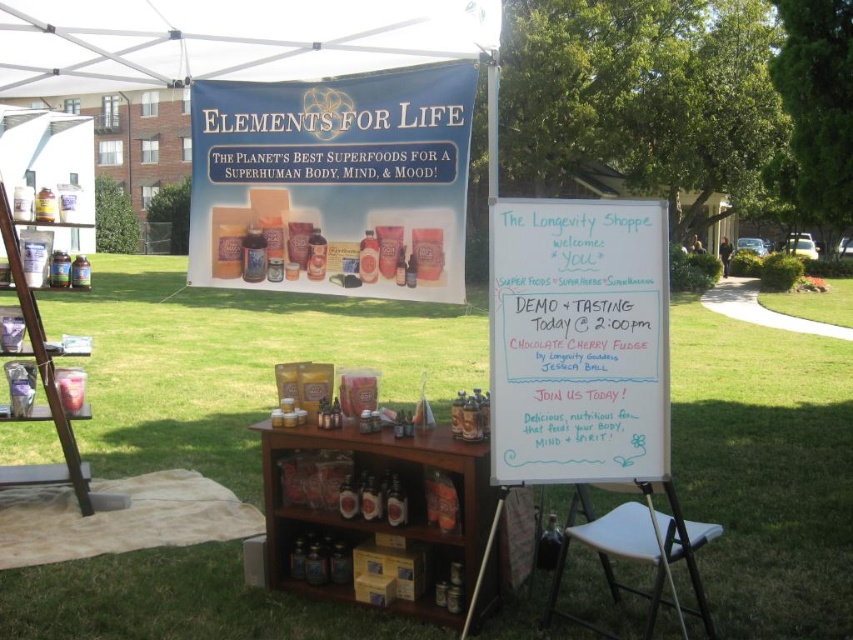
Question: Which point is closer to the camera taking this photo?

Choices:
 (A) (32, 477)
 (B) (711, 403)
 (C) (585, 396)
 (D) (376, 216)

Answer: (C)

Question: Can you confirm if white chalkboard at center is smaller than wooden ladder at left?

Choices:
 (A) no
 (B) yes

Answer: (B)

Question: Which is farther from the matte white board at center?

Choices:
 (A) white plastic stool at lower center
 (B) blue fabric banner at upper center
 (C) white fabric canopy at upper center
 (D) white chalkboard at center

Answer: (B)

Question: From the image, what is the correct spatial relationship of green grass at lower center in relation to white plastic stool at lower center?

Choices:
 (A) right
 (B) left

Answer: (B)

Question: Is white chalkboard at center to the right of wooden ladder at left from the viewer's perspective?

Choices:
 (A) yes
 (B) no

Answer: (A)

Question: Which object is closer to the camera taking this photo?

Choices:
 (A) matte white board at center
 (B) wooden ladder at left
 (C) white plastic stool at lower center
 (D) white chalkboard at center

Answer: (C)